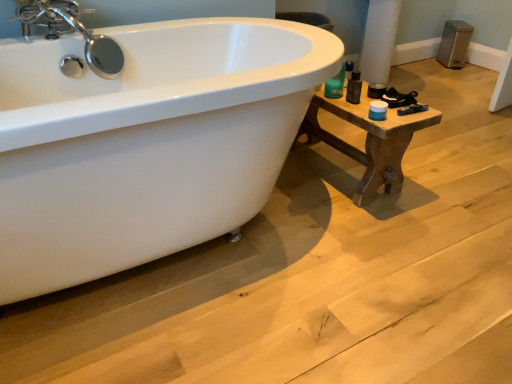
Where is `free space in front of brown wooden table at right`? This screenshot has width=512, height=384. free space in front of brown wooden table at right is located at coordinates (355, 234).